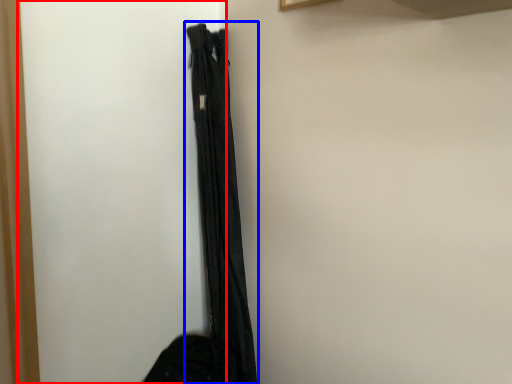
Question: Which point is closer to the camera, screen door (highlighted by a red box) or curtain (highlighted by a blue box)?

Choices:
 (A) screen door
 (B) curtain

Answer: (A)